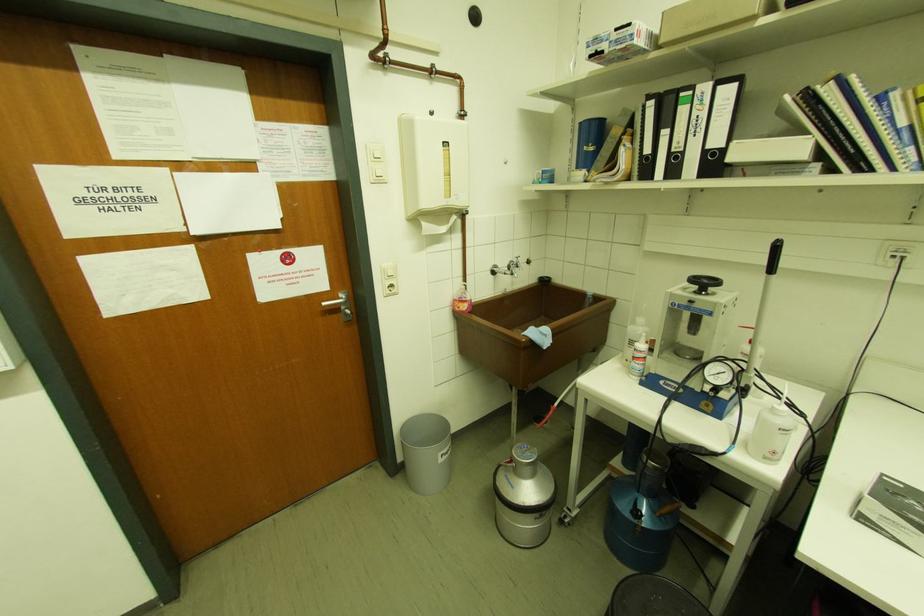
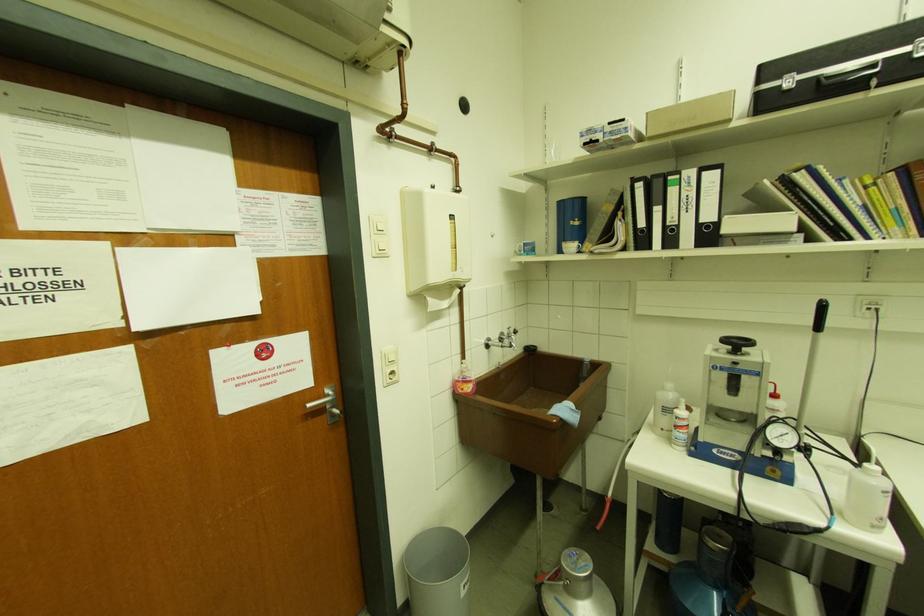
Find the pixel in the second image that matches point 584,176 in the first image.

(575, 246)